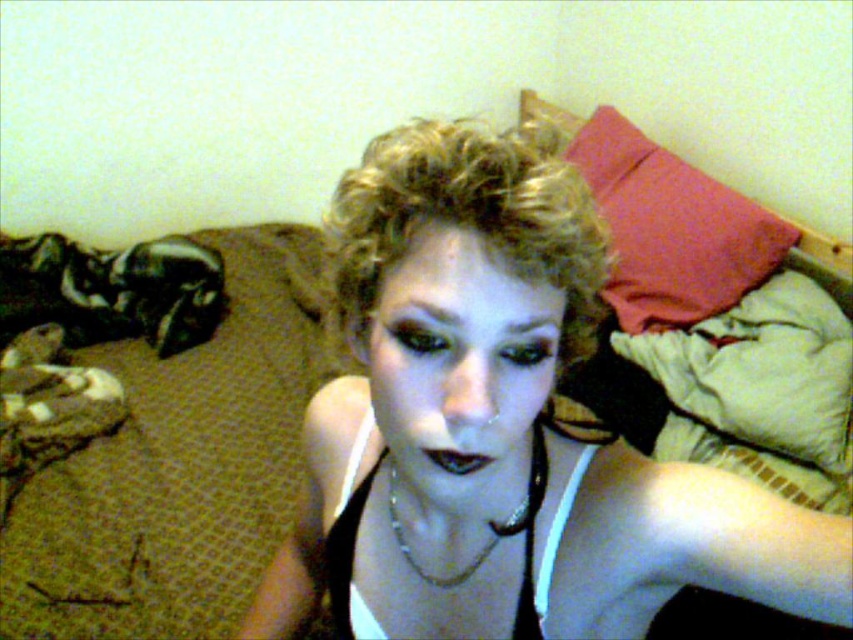
You are taking a photo of the person with their blonde curly hair at center and the red fabric pillow at upper right. To ensure the pillow is visible in the background, should you adjust the camera focus to include both objects?

The blonde curly hair at center is in front of the red fabric pillow at upper right, so if you focus on the blonde curly hair at center, the red fabric pillow at upper right may appear blurry. To have both in focus, adjust the camera focus to a wider depth of field or move the pillow closer to the hair.

You are a photographer setting up a shoot in this room. You need to position a 1.5 meter long prop between the red fabric pillow at upper right and the silver metallic chain at center. Will there be enough space for the prop?

The distance between the red fabric pillow at upper right and the silver metallic chain at center is 1.27 meters, which is shorter than the 1.5 meter long prop. Therefore, there is not enough space to place the prop between them.